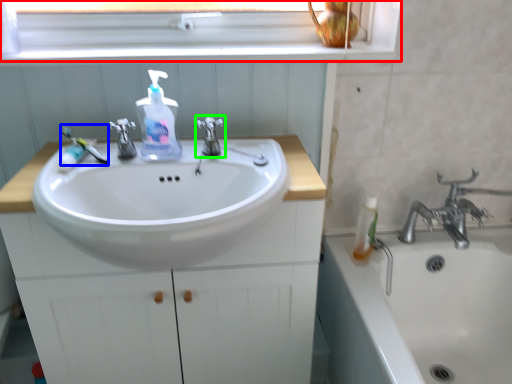
Question: Which object is the farthest from window frame (highlighted by a red box)? Choose among these: toothbrush (highlighted by a blue box) or tap (highlighted by a green box).

Choices:
 (A) toothbrush
 (B) tap

Answer: (A)